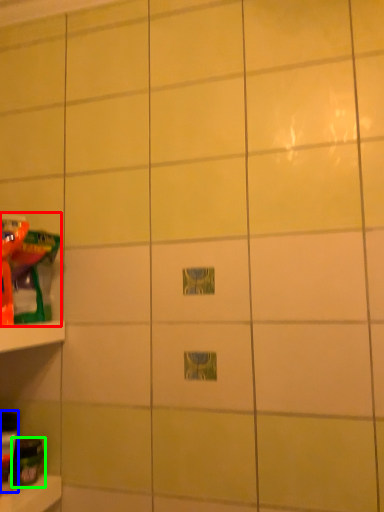
Question: Based on their relative distances, which object is farther from toy (highlighted by a red box)? Choose from toy (highlighted by a blue box) and toy (highlighted by a green box).

Choices:
 (A) toy
 (B) toy

Answer: (B)